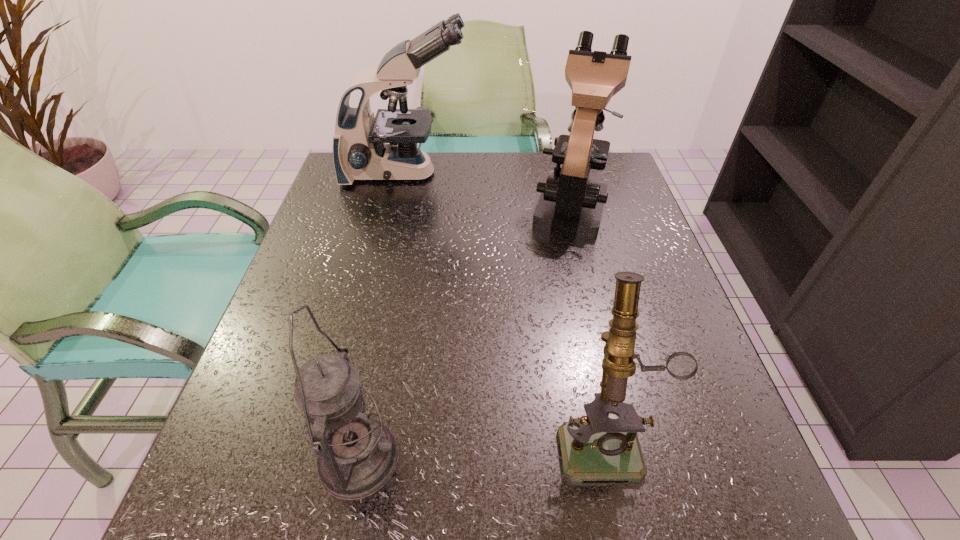
The height and width of the screenshot is (540, 960). In order to click on the leftmost microscope in this screenshot , I will do `click(360, 152)`.

Locate an element on the screen. This screenshot has height=540, width=960. oil lamp is located at coordinates (357, 455).

Where is `the nearest microscope`? The image size is (960, 540). the nearest microscope is located at coordinates (595, 447).

At what (x,y) coordinates should I click in order to perform the action: click on free space located through the eyepieces of the leftmost microscope. Please return your answer as a coordinate pair (x, y). This screenshot has width=960, height=540. Looking at the image, I should click on 579,173.

The image size is (960, 540). I want to click on free space located 0.050m on the right of the oil lamp, so click(x=432, y=459).

This screenshot has width=960, height=540. In order to click on oil lamp located in the near edge section of the desktop in this screenshot , I will do `click(357, 455)`.

I want to click on microscope that is at the near edge, so click(x=595, y=447).

This screenshot has width=960, height=540. Identify the location of microscope that is positioned at the left edge. (360, 152).

Where is `oil lamp at the left edge`? The image size is (960, 540). oil lamp at the left edge is located at coordinates (357, 455).

You are a GUI agent. You are given a task and a screenshot of the screen. Output one action in this format:
    pyautogui.click(x=<x>, y=<y>)
    Task: Click on the object that is positioned at the far left corner
    
    Given the screenshot: What is the action you would take?
    pyautogui.click(x=360, y=152)